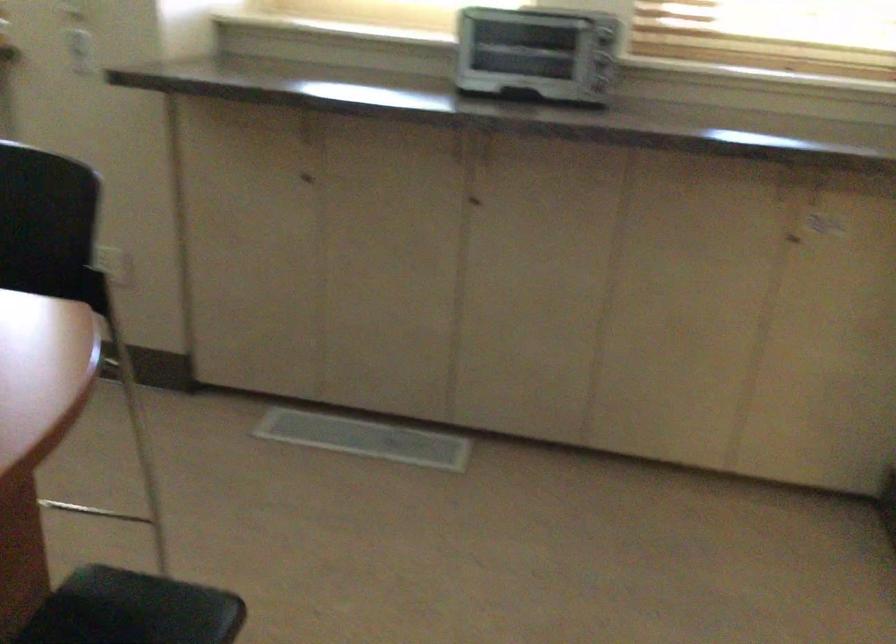
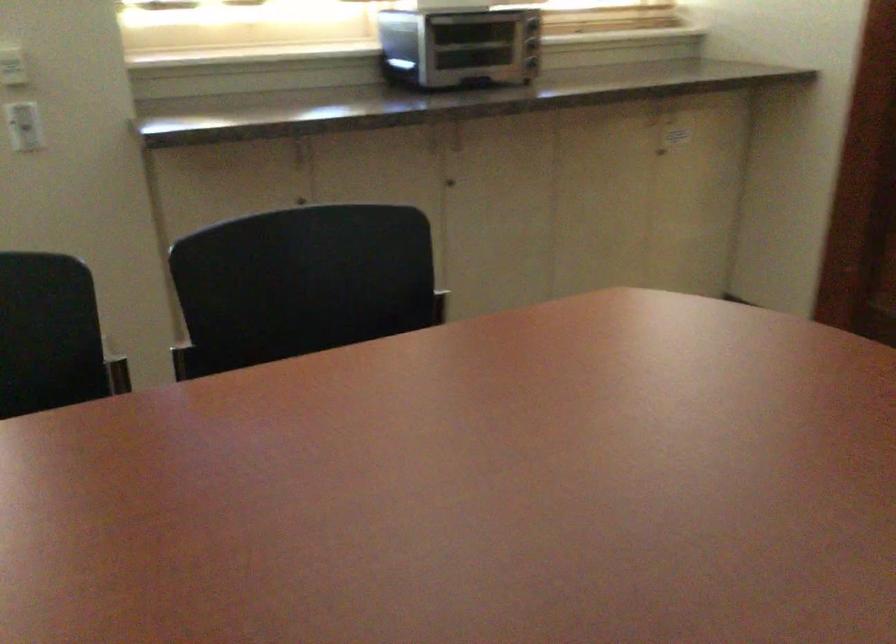
Find the pixel in the second image that matches [595,93] in the first image.

(531, 62)